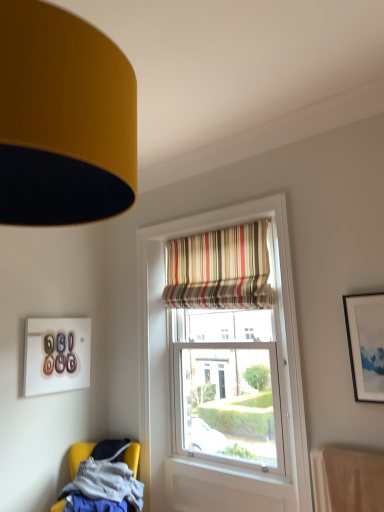
Question: Looking at their shapes, would you say matte glass picture frame at upper left, placed as the 1th picture frame when sorted from back to front, is wider or thinner than striped fabric curtain at upper center?

Choices:
 (A) thin
 (B) wide

Answer: (A)

Question: Do you think matte glass picture frame at upper left, placed as the 1th picture frame when sorted from left to right, is within striped fabric curtain at upper center, or outside of it?

Choices:
 (A) inside
 (B) outside

Answer: (B)

Question: Which object is positioned farthest from the yellow fabric chair at lower left?

Choices:
 (A) matte glass picture frame at upper left, placed as the 1th picture frame when sorted from back to front
 (B) striped fabric curtain at upper center
 (C) matte white picture frame at upper right, the second picture frame when ordered from back to front

Answer: (C)

Question: Based on their relative distances, which object is farther from the yellow fabric chair at lower left?

Choices:
 (A) striped fabric curtain at upper center
 (B) matte white picture frame at upper right, positioned as the 2th picture frame in left-to-right order
 (C) matte glass picture frame at upper left, placed as the 1th picture frame when sorted from left to right

Answer: (B)